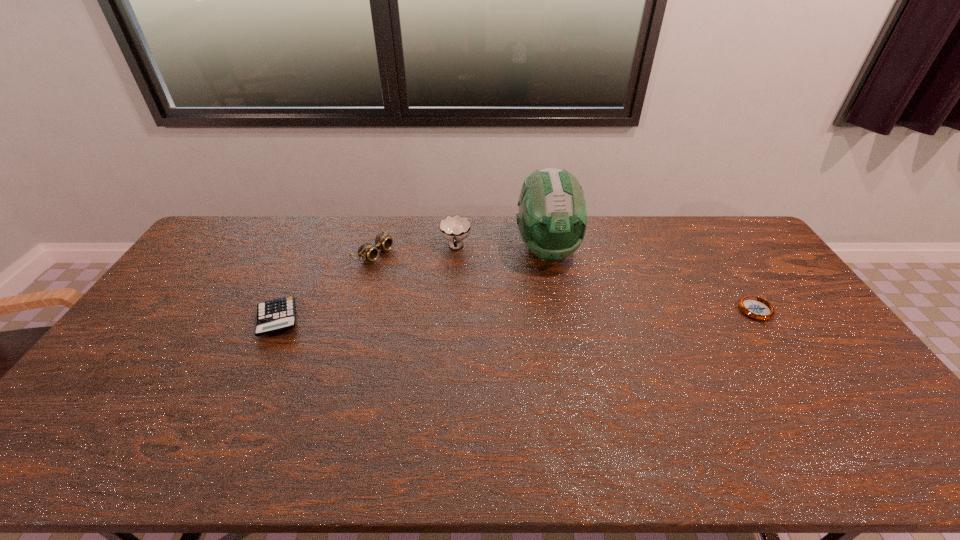
Identify which object is the second nearest to the third shortest object. Please provide its 2D coordinates. Your answer should be formatted as a tuple, i.e. [(x, y)], where the tuple contains the x and y coordinates of a point satisfying the conditions above.

[(276, 315)]

Select which object appears as the second closest to the cup. Please provide its 2D coordinates. Your answer should be formatted as a tuple, i.e. [(x, y)], where the tuple contains the x and y coordinates of a point satisfying the conditions above.

[(366, 251)]

What are the coordinates of `vacant area in the image that satisfies the following two spatial constraints: 1. on the front side of the third object from left to right; 2. on the left side of the football helmet` in the screenshot? It's located at [x=456, y=249].

At what (x,y) coordinates should I click in order to perform the action: click on free space that satisfies the following two spatial constraints: 1. on the back side of the goggles; 2. on the right side of the second object from right to left. Please return your answer as a coordinate pair (x, y). The height and width of the screenshot is (540, 960). Looking at the image, I should click on (374, 249).